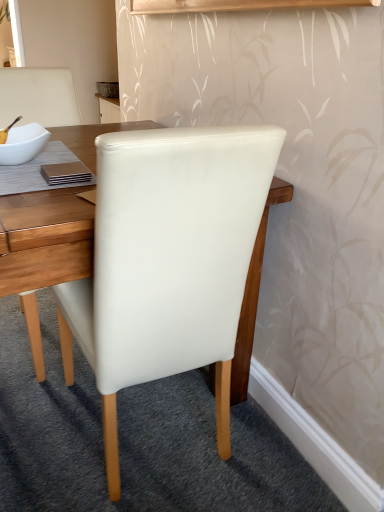
Locate an element on the screen. The height and width of the screenshot is (512, 384). white glossy bowl at upper left is located at coordinates (23, 144).

Describe the element at coordinates (23, 144) in the screenshot. Image resolution: width=384 pixels, height=512 pixels. I see `white glossy bowl at upper left` at that location.

What do you see at coordinates (167, 262) in the screenshot?
I see `white leather chair at center` at bounding box center [167, 262].

Locate an element on the screen. This screenshot has width=384, height=512. white leather chair at center is located at coordinates (167, 262).

At what (x,y) coordinates should I click in order to perform the action: click on white glossy bowl at upper left. Please return your answer as a coordinate pair (x, y). The image size is (384, 512). Looking at the image, I should click on (23, 144).

Between white glossy bowl at upper left and white leather chair at center, which one appears on the left side from the viewer's perspective?

white glossy bowl at upper left.

Considering the positions of objects white glossy bowl at upper left and white leather chair at center in the image provided, who is behind, white glossy bowl at upper left or white leather chair at center?

white glossy bowl at upper left is behind.

Which is closer to the camera, (x=6, y=155) or (x=58, y=298)?

The point (x=6, y=155) is in front.

From the image's perspective, is white glossy bowl at upper left under white leather chair at center?

No, from the image's perspective, white glossy bowl at upper left is not below white leather chair at center.

From a real-world perspective, between white glossy bowl at upper left and white leather chair at center, who is vertically higher?

white glossy bowl at upper left.

Is white glossy bowl at upper left wider or thinner than white leather chair at center?

In the image, white glossy bowl at upper left appears to be more narrow than white leather chair at center.

Considering the relative sizes of white glossy bowl at upper left and white leather chair at center in the image provided, is white glossy bowl at upper left shorter than white leather chair at center?

Correct, white glossy bowl at upper left is not as tall as white leather chair at center.

Considering the sizes of objects white glossy bowl at upper left and white leather chair at center in the image provided, who is bigger, white glossy bowl at upper left or white leather chair at center?

white leather chair at center.

Is white glossy bowl at upper left outside of white leather chair at center?

white glossy bowl at upper left lies outside white leather chair at center's area.

Are white glossy bowl at upper left and white leather chair at center making contact?

No, white glossy bowl at upper left is not in contact with white leather chair at center.

Is white glossy bowl at upper left positioned with its back to white leather chair at center?

No, white glossy bowl at upper left is not facing away from white leather chair at center.

What's the angular difference between white glossy bowl at upper left and white leather chair at center's facing directions?

white glossy bowl at upper left and white leather chair at center are facing 0.00313 degrees away from each other.

The image size is (384, 512). I want to click on bowl above the white leather chair at center (from the image's perspective), so click(x=23, y=144).

Which object is positioned more to the right, white leather chair at center or white glossy bowl at upper left?

From the viewer's perspective, white leather chair at center appears more on the right side.

Is white leather chair at center positioned in front of white glossy bowl at upper left?

Yes.

Consider the image. Which is less distant, (171, 295) or (19, 127)?

Point (171, 295)

From the image's perspective, which one is positioned higher, white leather chair at center or white glossy bowl at upper left?

white glossy bowl at upper left.

From a real-world perspective, which is physically above, white leather chair at center or white glossy bowl at upper left?

In real-world perspective, white glossy bowl at upper left is above.

Considering the sizes of objects white leather chair at center and white glossy bowl at upper left in the image provided, who is wider, white leather chair at center or white glossy bowl at upper left?

With larger width is white leather chair at center.

Does white leather chair at center have a lesser height compared to white glossy bowl at upper left?

No.

From the picture: Is white leather chair at center bigger than white glossy bowl at upper left?

Yes, white leather chair at center is bigger than white glossy bowl at upper left.

Is white glossy bowl at upper left located within white leather chair at center?

No, white glossy bowl at upper left is not surrounded by white leather chair at center.

In the scene shown: Is white leather chair at center in contact with white glossy bowl at upper left?

white leather chair at center and white glossy bowl at upper left are clearly separated.

Is white leather chair at center looking in the opposite direction of white glossy bowl at upper left?

white leather chair at center is not turned away from white glossy bowl at upper left.

In the scene shown: How different are the orientations of white leather chair at center and white glossy bowl at upper left in degrees?

The angle between the facing direction of white leather chair at center and the facing direction of white glossy bowl at upper left is 0.00313 degrees.

This screenshot has width=384, height=512. Find the location of `bowl behind the white leather chair at center`. bowl behind the white leather chair at center is located at coordinates (23, 144).

Find the location of a particular element. chair in front of the white glossy bowl at upper left is located at coordinates (167, 262).

You are a GUI agent. You are given a task and a screenshot of the screen. Output one action in this format:
    pyautogui.click(x=<x>, y=<y>)
    Task: Click on the chair below the white glossy bowl at upper left (from a real-world perspective)
    This screenshot has width=384, height=512.
    Given the screenshot: What is the action you would take?
    pyautogui.click(x=167, y=262)